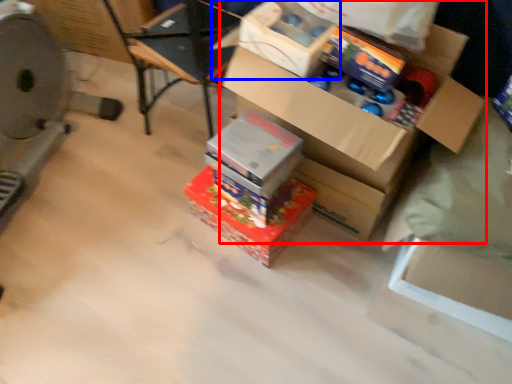
Question: Which of the following is the closest to the observer, box (highlighted by a red box) or storage box (highlighted by a blue box)?

Choices:
 (A) box
 (B) storage box

Answer: (A)